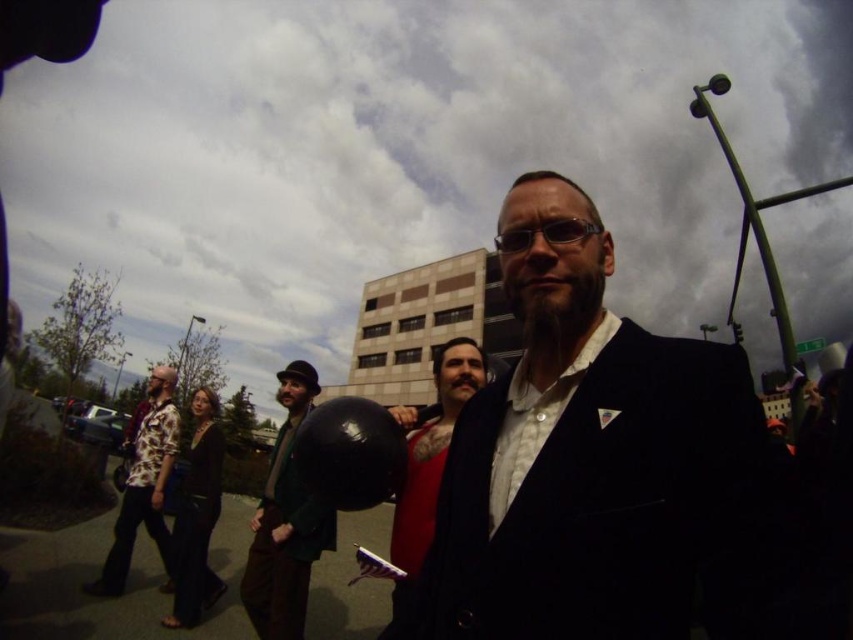
Between point (413, 540) and point (141, 436), which one is positioned in front?

Point (413, 540) is in front.

Between red velvet coat at center and printed cotton shirt at left, which one has more height?

red velvet coat at center

What do you see at coordinates (427, 468) in the screenshot? Image resolution: width=853 pixels, height=640 pixels. I see `red velvet coat at center` at bounding box center [427, 468].

Locate an element on the screen. The image size is (853, 640). red velvet coat at center is located at coordinates (427, 468).

This screenshot has height=640, width=853. Identify the location of velvet black suit at center. (587, 456).

Is velvet black suit at center taller than green wool coat at center?

No.

Image resolution: width=853 pixels, height=640 pixels. I want to click on velvet black suit at center, so click(x=587, y=456).

Is velvet black suit at center thinner than red velvet coat at center?

Correct, velvet black suit at center's width is less than red velvet coat at center's.

Can you confirm if velvet black suit at center is positioned below red velvet coat at center?

No, velvet black suit at center is not below red velvet coat at center.

Who is more distant from viewer, (589,218) or (440,435)?

The point (440,435) is more distant.

Identify the location of velvet black suit at center. Image resolution: width=853 pixels, height=640 pixels. (587, 456).